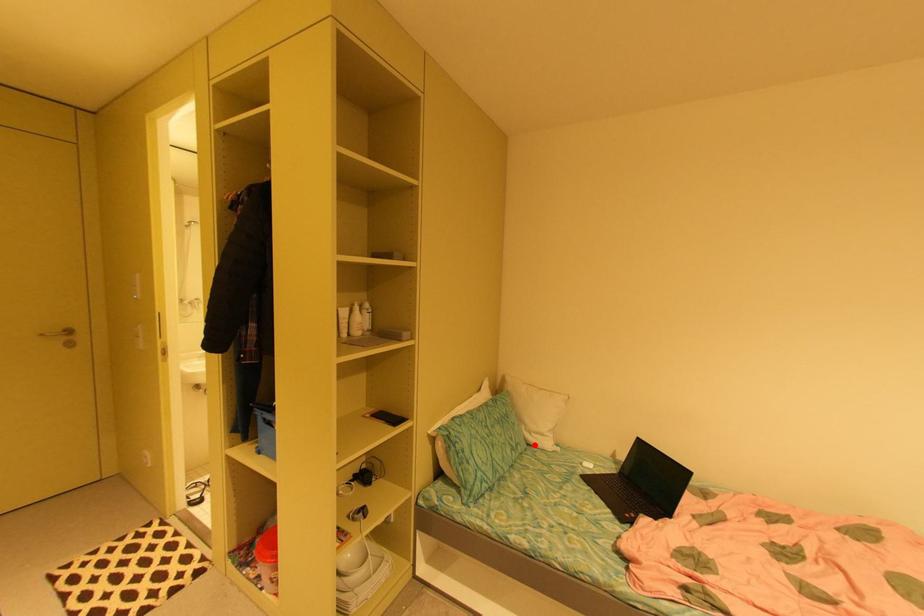
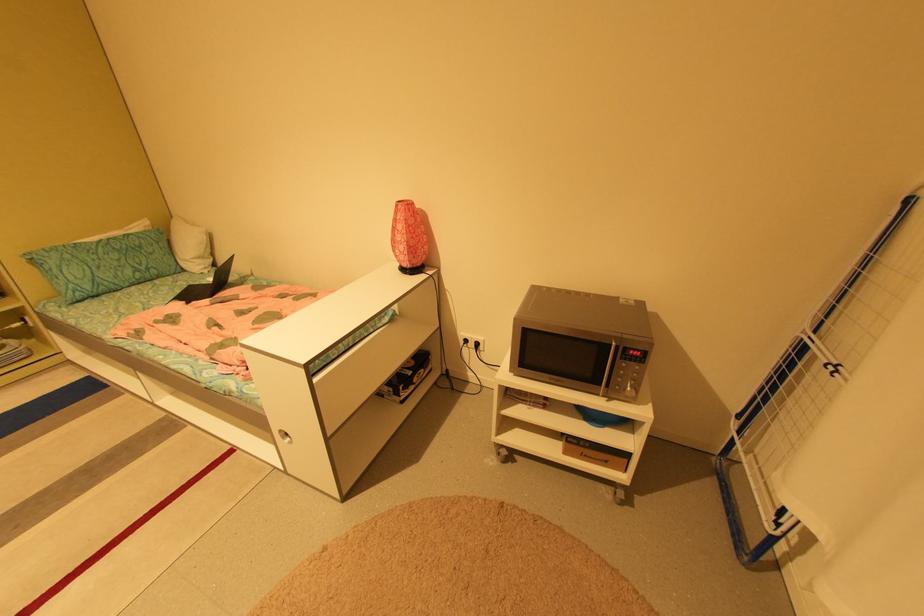
In the second image, find the point that corresponds to the highlighted location in the first image.

(190, 270)